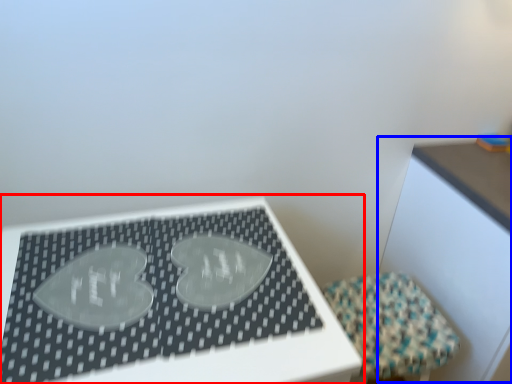
Question: Which object appears closest to the camera in this image, table (highlighted by a red box) or table (highlighted by a blue box)?

Choices:
 (A) table
 (B) table

Answer: (A)